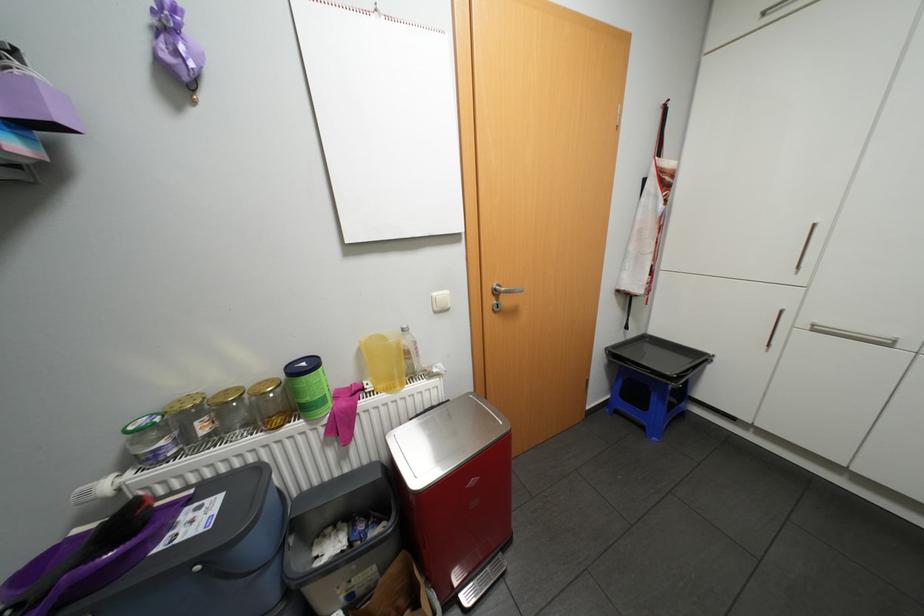
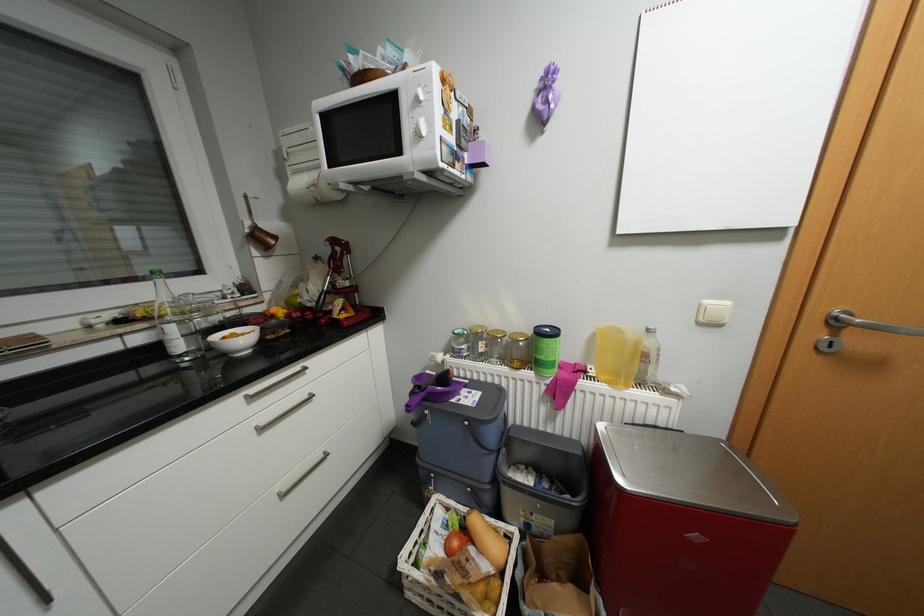
In the second image, find the point that corresponds to point (377, 386) in the first image.

(600, 371)